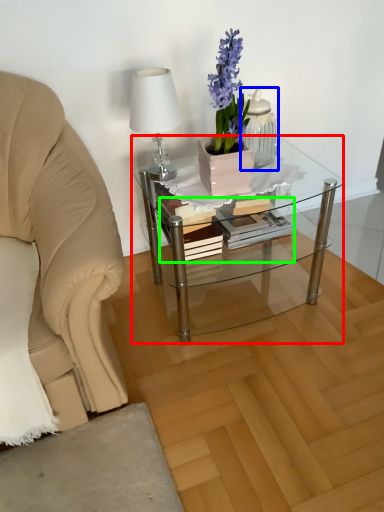
Question: Which is farther away from coffee table (highlighted by a red box)? tableware (highlighted by a blue box) or book (highlighted by a green box)?

Choices:
 (A) tableware
 (B) book

Answer: (A)